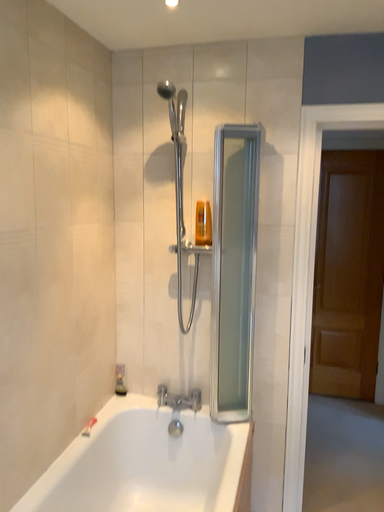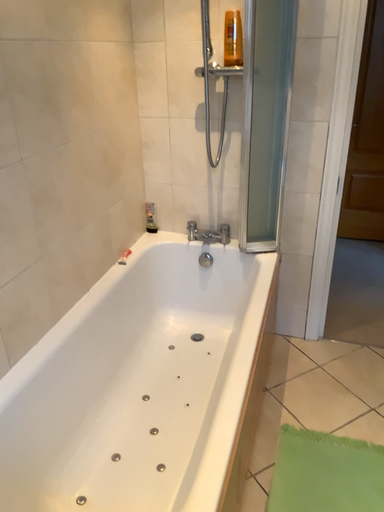
Question: How did the camera likely rotate when shooting the video?

Choices:
 (A) rotated downward
 (B) rotated upward

Answer: (A)